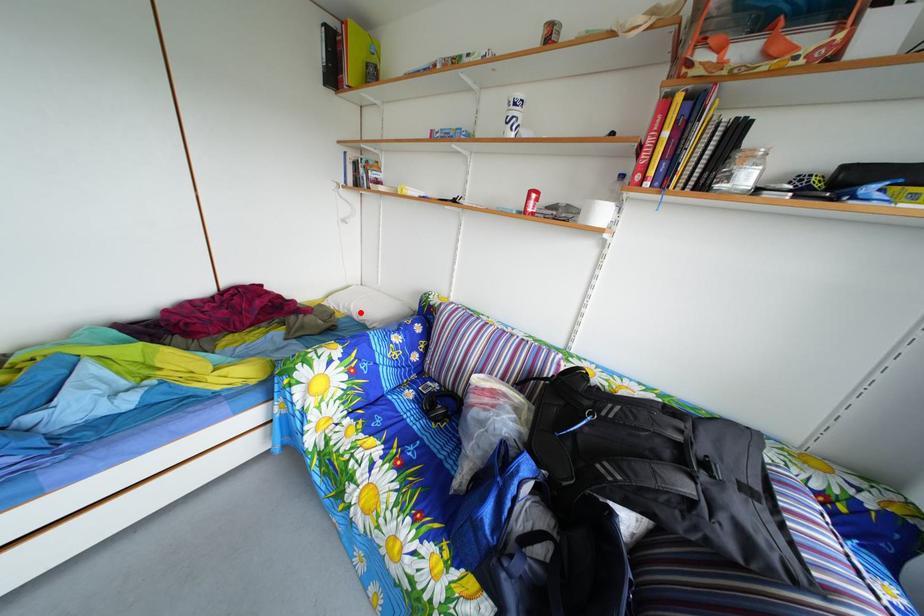
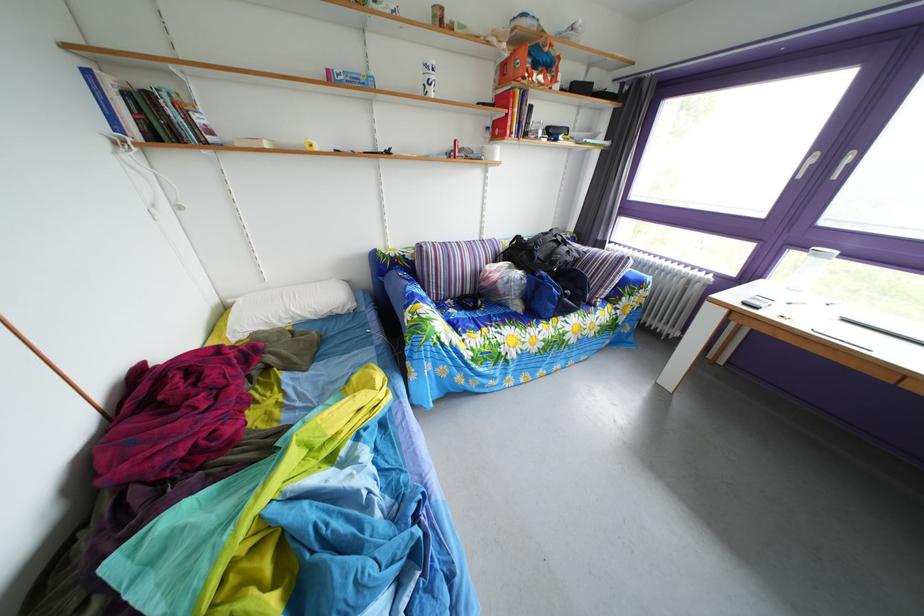
Question: I am providing you with two images of the same scene from different viewpoints. Image1 has a red point marked. In image2, the corresponding 3D location appears at what relative position? Reply with the corresponding letter.

Choices:
 (A) Closer
 (B) Farther

Answer: (A)